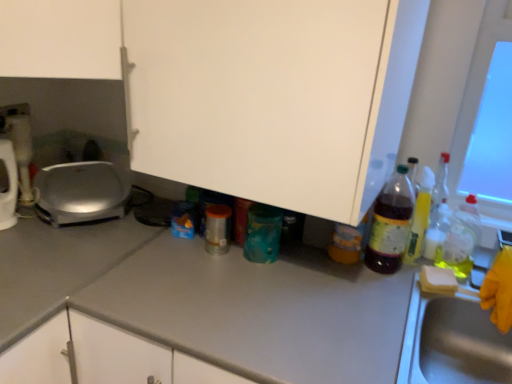
Identify the location of vacant area that is in front of translucent plastic bottle at right, the 1th bottle when ordered from right to left. This screenshot has height=384, width=512. (438, 279).